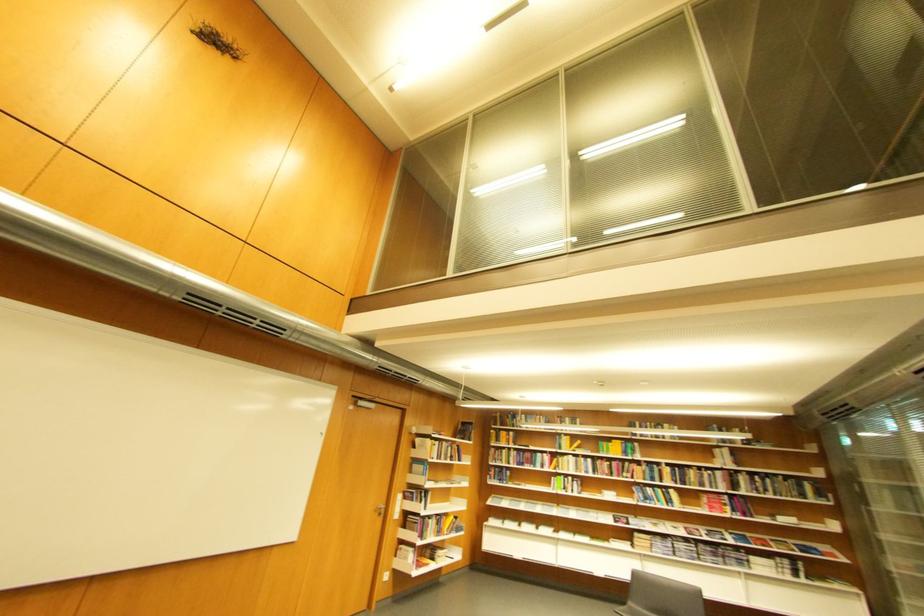
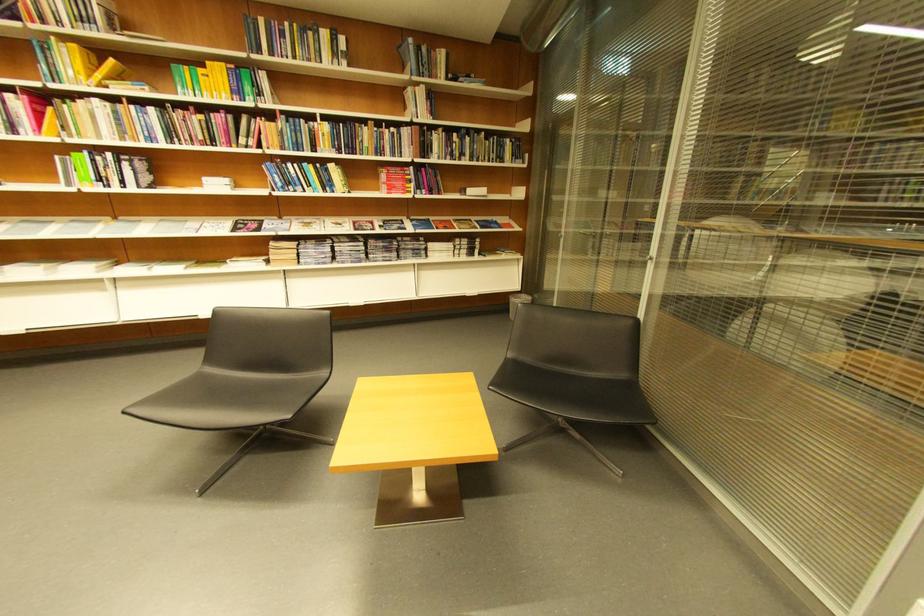
Locate, in the second image, the point that corresponds to the point at 652,500 in the first image.

(290, 185)